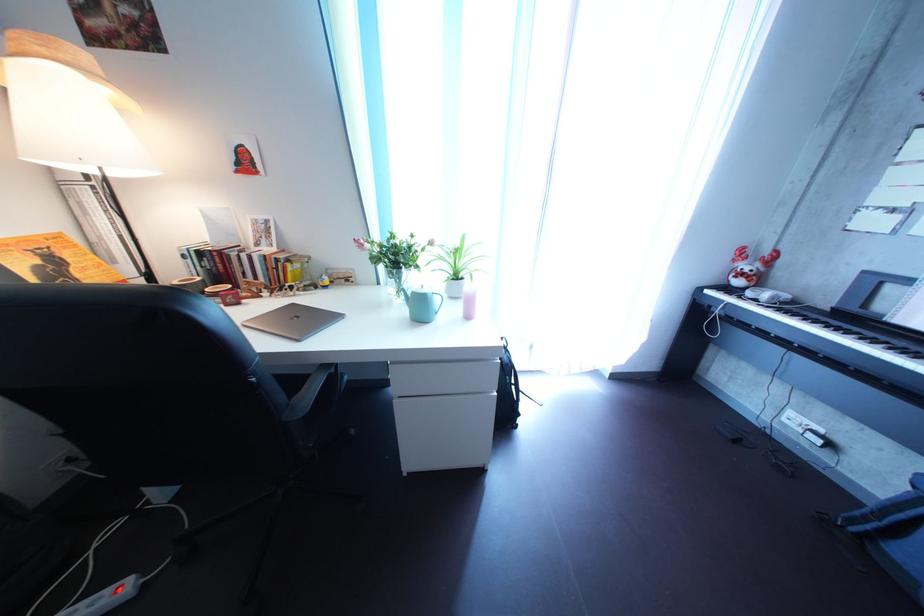
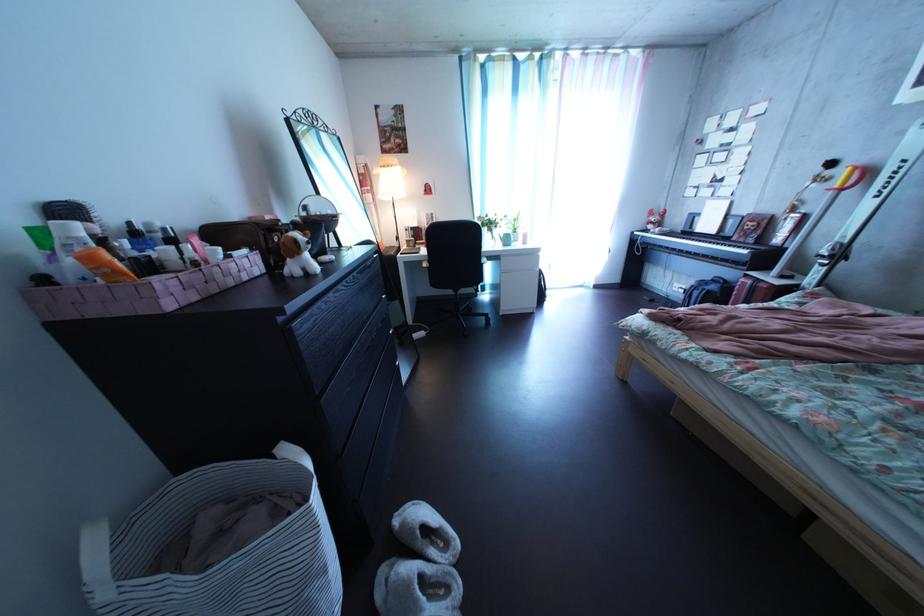
What movement of the cameraman would produce the second image?

The cameraman moved toward left, backward.